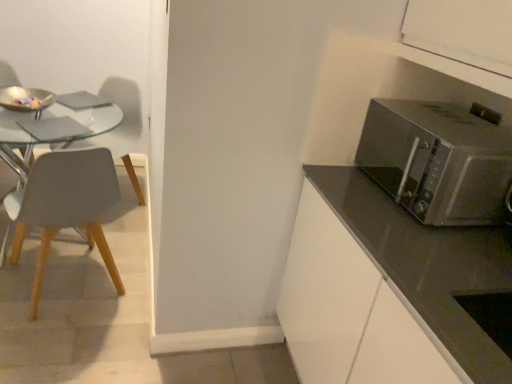
This screenshot has width=512, height=384. I want to click on spots to the right of matte gray chair at left, the 2th chair viewed from the back, so click(130, 307).